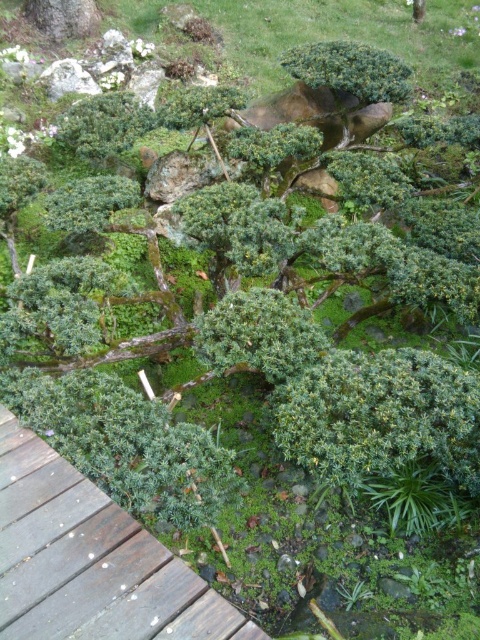
Is green leafy bush at center shorter than green matte bush at upper center?

Correct, green leafy bush at center is not as tall as green matte bush at upper center.

Is green leafy bush at center closer to the viewer compared to green matte bush at upper center?

Yes, it is in front of green matte bush at upper center.

Who is more distant from viewer, [409,364] or [288,54]?

Point [288,54]

Find the location of a particular element. The height and width of the screenshot is (640, 480). green leafy bush at center is located at coordinates (380, 417).

The width and height of the screenshot is (480, 640). What do you see at coordinates (90, 561) in the screenshot? I see `brown wooden path at lower left` at bounding box center [90, 561].

Is point (16, 424) in front of point (324, 83)?

Yes, point (16, 424) is in front of point (324, 83).

Locate an element on the screen. The image size is (480, 640). brown wooden path at lower left is located at coordinates (90, 561).

Is brown wooden path at lower left bigger than green leafy bush at center?

Correct, brown wooden path at lower left is larger in size than green leafy bush at center.

Which is in front, point (24, 428) or point (313, 464)?

Positioned in front is point (313, 464).

Between point (71, 548) and point (282, 403), which one is positioned behind?

The point (282, 403) is behind.

At what (x,y) coordinates should I click in order to perform the action: click on brown wooden path at lower left. Please return your answer as a coordinate pair (x, y). Looking at the image, I should click on (90, 561).